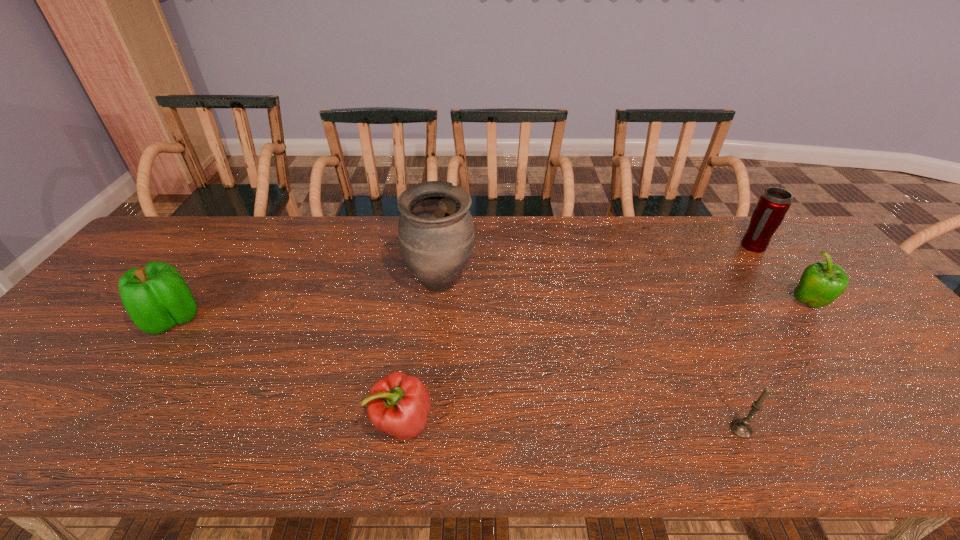
This screenshot has height=540, width=960. In order to click on free space at the near edge in this screenshot , I will do `click(225, 428)`.

Identify the location of vacant area at the right edge. The height and width of the screenshot is (540, 960). (899, 383).

Identify the location of vacant space at the far right corner of the desktop. This screenshot has width=960, height=540. click(x=812, y=244).

Where is `blank region between the rightmost bell pepper and the leftmost object`? The image size is (960, 540). blank region between the rightmost bell pepper and the leftmost object is located at coordinates (491, 312).

This screenshot has height=540, width=960. Find the location of `free space between the second bell pepper from left to right and the rightmost bell pepper`. free space between the second bell pepper from left to right and the rightmost bell pepper is located at coordinates (606, 363).

The width and height of the screenshot is (960, 540). In order to click on free point between the tallest object and the third object from right to left in this screenshot , I will do (x=590, y=356).

Where is `free space between the third object from right to left and the farthest object`? The image size is (960, 540). free space between the third object from right to left and the farthest object is located at coordinates (747, 338).

The width and height of the screenshot is (960, 540). In order to click on unoccupied position between the fourth object from left to right and the second bell pepper from left to right in this screenshot , I will do `click(572, 426)`.

At what (x,y) coordinates should I click in order to perform the action: click on empty space that is in between the second bell pepper from right to left and the leftmost bell pepper. Please return your answer as a coordinate pair (x, y). Looking at the image, I should click on (287, 371).

Locate an element on the screen. This screenshot has width=960, height=540. vacant area that lies between the urn and the second bell pepper from right to left is located at coordinates (421, 353).